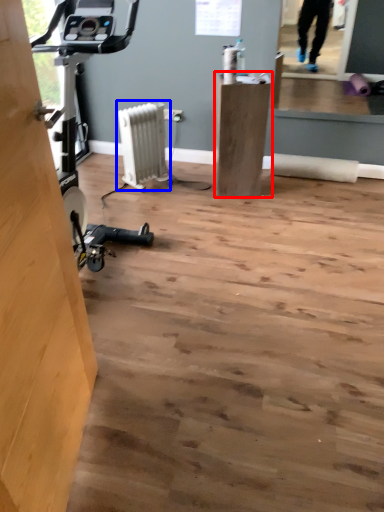
Question: Which object is further to the camera taking this photo, furniture (highlighted by a red box) or radiator (highlighted by a blue box)?

Choices:
 (A) furniture
 (B) radiator

Answer: (B)